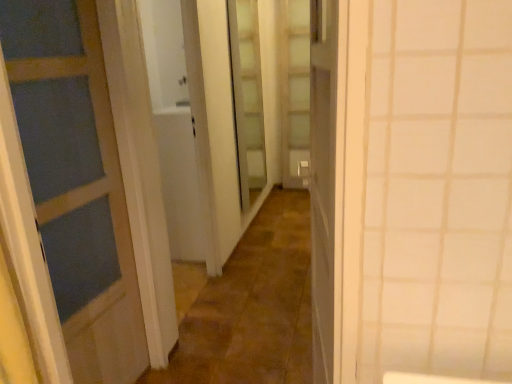
Measure the distance between point (292, 59) and camera.

The depth of point (292, 59) is 14.15 feet.

What is the approximate width of brown stone alley at center?

The width of brown stone alley at center is 30.45 inches.

What is the approximate width of clear glass door at center, which is counted as the 2th screen door, starting from the right?

clear glass door at center, which is counted as the 2th screen door, starting from the right, is 3.58 inches in width.

Describe the element at coordinates (247, 101) in the screenshot. I see `clear glass door at center, which is the first screen door from front to back` at that location.

The width and height of the screenshot is (512, 384). What are the coordinates of `translucent glass screen door at center, which is counted as the 2th screen door, starting from the left` in the screenshot? It's located at (295, 90).

Which is behind, point (301, 120) or point (271, 224)?

The point (301, 120) is more distant.

Which of these two, translucent glass screen door at center, the 1th screen door from the back, or brown stone alley at center, is thinner?

With smaller width is translucent glass screen door at center, the 1th screen door from the back.

Considering the sizes of objects translucent glass screen door at center, which is counted as the first screen door, starting from the right, and brown stone alley at center in the image provided, who is shorter, translucent glass screen door at center, which is counted as the first screen door, starting from the right, or brown stone alley at center?

brown stone alley at center is shorter.

Is translucent glass screen door at center, the 1th screen door from the back, at the left side of brown stone alley at center?

In fact, translucent glass screen door at center, the 1th screen door from the back, is to the right of brown stone alley at center.

Is translucent glass screen door at center, which is counted as the first screen door, starting from the right, facing away from clear glass door at center, which is counted as the 2th screen door, starting from the right?

No, translucent glass screen door at center, which is counted as the first screen door, starting from the right, is not facing the opposite direction of clear glass door at center, which is counted as the 2th screen door, starting from the right.

In order to click on screen door on the right of clear glass door at center, which is counted as the 2th screen door, starting from the right in this screenshot , I will do `click(295, 90)`.

Which point is more forward, (287, 85) or (258, 78)?

The point (258, 78) is more forward.

Which object is wider, translucent glass screen door at center, which is counted as the 2th screen door, starting from the left, or clear glass door at center, the 2th screen door when ordered from back to front?

Wider between the two is translucent glass screen door at center, which is counted as the 2th screen door, starting from the left.

Is clear glass door at center, acting as the 1th screen door starting from the left, far away from translucent glass screen door at center, which is counted as the 2th screen door, starting from the left?

clear glass door at center, acting as the 1th screen door starting from the left, is near translucent glass screen door at center, which is counted as the 2th screen door, starting from the left, not far away.

Between clear glass door at center, the 2th screen door when ordered from back to front, and translucent glass screen door at center, which is counted as the 2th screen door, starting from the left, which one has less height?

clear glass door at center, the 2th screen door when ordered from back to front.

From the image's perspective, is clear glass door at center, which is counted as the 2th screen door, starting from the right, located above or below translucent glass screen door at center, the second screen door from the front?

Clearly, from the image's perspective, clear glass door at center, which is counted as the 2th screen door, starting from the right, is below translucent glass screen door at center, the second screen door from the front.

Can you confirm if clear glass door at center, which is counted as the 2th screen door, starting from the right, is smaller than translucent glass screen door at center, the 1th screen door from the back?

No.

Between brown stone alley at center and clear glass door at center, which is the first screen door from front to back, which one has less height?

brown stone alley at center is shorter.

Is brown stone alley at center bigger than clear glass door at center, the 2th screen door when ordered from back to front?

No.

How far apart are brown stone alley at center and clear glass door at center, which is counted as the 2th screen door, starting from the right?

A distance of 3.55 feet exists between brown stone alley at center and clear glass door at center, which is counted as the 2th screen door, starting from the right.

Considering the relative positions of brown stone alley at center and clear glass door at center, acting as the 1th screen door starting from the left, in the image provided, is brown stone alley at center to the left of clear glass door at center, acting as the 1th screen door starting from the left, from the viewer's perspective?

No.

From a real-world perspective, does clear glass door at center, which is the first screen door from front to back, sit lower than brown stone alley at center?

No, from a real-world perspective, clear glass door at center, which is the first screen door from front to back, is not below brown stone alley at center.

There is a brown stone alley at center. Identify the location of the 1st screen door above it (from the image's perspective). (247, 101).

Would you say clear glass door at center, the 2th screen door when ordered from back to front, is to the left or to the right of brown stone alley at center in the picture?

Based on their positions, clear glass door at center, the 2th screen door when ordered from back to front, is located to the left of brown stone alley at center.

Are clear glass door at center, the 2th screen door when ordered from back to front, and brown stone alley at center making contact?

There is a gap between clear glass door at center, the 2th screen door when ordered from back to front, and brown stone alley at center.

Does point (226, 316) lie behind point (285, 148)?

That is False.

Is brown stone alley at center at the left side of translucent glass screen door at center, the 1th screen door from the back?

Yes.

Is brown stone alley at center bigger than translucent glass screen door at center, which is counted as the first screen door, starting from the right?

Yes.

From a real-world perspective, is brown stone alley at center above or below translucent glass screen door at center, which is counted as the 2th screen door, starting from the left?

brown stone alley at center is below translucent glass screen door at center, which is counted as the 2th screen door, starting from the left.

In the image, there is a translucent glass screen door at center, which is counted as the 2th screen door, starting from the left. At what (x,y) coordinates should I click in order to perform the action: click on alley below it (from the image's perspective). Please return your answer as a coordinate pair (x, y). The image size is (512, 384). Looking at the image, I should click on (253, 307).

The image size is (512, 384). I want to click on screen door above the translucent glass screen door at center, which is counted as the first screen door, starting from the right (from a real-world perspective), so click(247, 101).

In the scene shown: Based on their spatial positions, is brown stone alley at center or clear glass door at center, the 2th screen door when ordered from back to front, closer to translucent glass screen door at center, which is counted as the first screen door, starting from the right?

clear glass door at center, the 2th screen door when ordered from back to front, is closer to translucent glass screen door at center, which is counted as the first screen door, starting from the right.

Based on the photo, looking at the image, which one is located closer to clear glass door at center, acting as the 1th screen door starting from the left, translucent glass screen door at center, the 1th screen door from the back, or brown stone alley at center?

The object closer to clear glass door at center, acting as the 1th screen door starting from the left, is translucent glass screen door at center, the 1th screen door from the back.

Estimate the real-world distances between objects in this image. Which object is closer to brown stone alley at center, clear glass door at center, acting as the 1th screen door starting from the left, or translucent glass screen door at center, which is counted as the first screen door, starting from the right?

clear glass door at center, acting as the 1th screen door starting from the left, is closer to brown stone alley at center.

Which object lies further to the anchor point translucent glass screen door at center, which is counted as the first screen door, starting from the right, clear glass door at center, which is the first screen door from front to back, or brown stone alley at center?

brown stone alley at center is positioned further to the anchor translucent glass screen door at center, which is counted as the first screen door, starting from the right.

Considering their positions, is translucent glass screen door at center, which is counted as the first screen door, starting from the right, positioned closer to brown stone alley at center than clear glass door at center, which is the first screen door from front to back?

The object closer to brown stone alley at center is clear glass door at center, which is the first screen door from front to back.

Looking at the image, which one is located further to clear glass door at center, which is the first screen door from front to back, brown stone alley at center or translucent glass screen door at center, which is counted as the first screen door, starting from the right?

Among the two, brown stone alley at center is located further to clear glass door at center, which is the first screen door from front to back.

You are a GUI agent. You are given a task and a screenshot of the screen. Output one action in this format:
    pyautogui.click(x=<x>, y=<y>)
    Task: Click on the screen door between brown stone alley at center and translucent glass screen door at center, which is counted as the first screen door, starting from the right, from front to back
    The height and width of the screenshot is (384, 512).
    Given the screenshot: What is the action you would take?
    pyautogui.click(x=247, y=101)